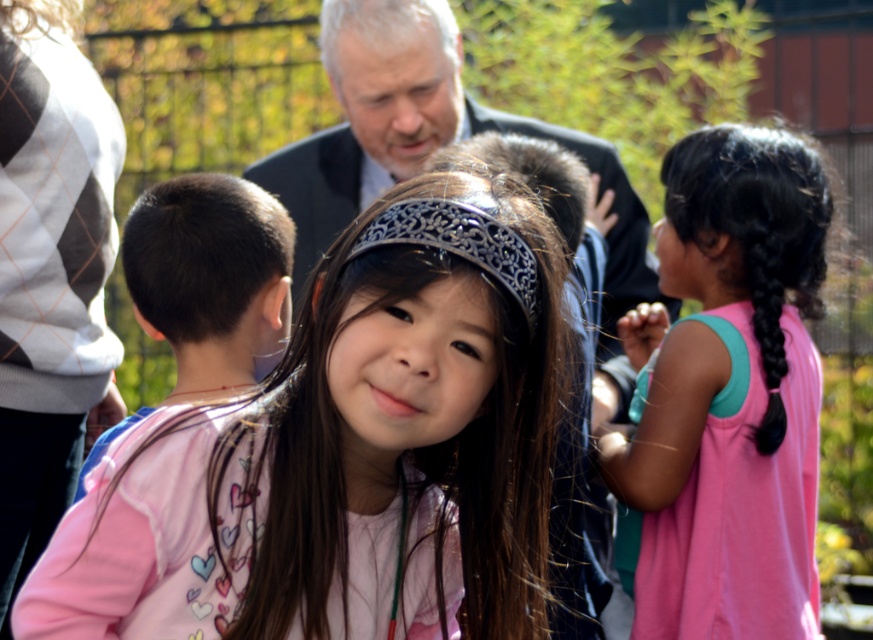
Question: Is pink fabric at center to the left of metallic silver headscarf at center from the viewer's perspective?

Choices:
 (A) yes
 (B) no

Answer: (A)

Question: Which of the following is the farthest from the observer?

Choices:
 (A) black shiny hair at center
 (B) black silky hair at right
 (C) gray matte hair at upper center
 (D) pink fabric at center

Answer: (C)

Question: Can you confirm if pink fabric at center is positioned above black smooth hair at left?

Choices:
 (A) no
 (B) yes

Answer: (A)

Question: Does pink fabric at center have a smaller size compared to gray matte hair at upper center?

Choices:
 (A) yes
 (B) no

Answer: (B)

Question: Which of the following is the farthest from the observer?

Choices:
 (A) smooth black suit at center
 (B) black shiny hair at center
 (C) metallic silver headscarf at center

Answer: (A)

Question: Which point is farther to the camera?

Choices:
 (A) gray matte hair at upper center
 (B) smooth black suit at center
 (C) black shiny hair at center

Answer: (B)